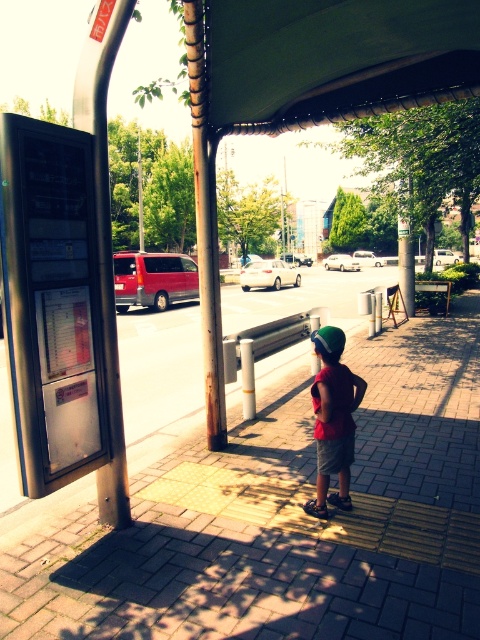
You are a parent trying to locate your child at a bus stop. You see a child wearing a matte red shirt at center and a green matte baseball hat at center. Which clothing item is higher on the child?

The matte red shirt at center is taller than the green matte baseball hat at center, so the matte red shirt at center is higher on the child.

You are a delivery person who needs to place a small package on the ground at the bus stop. The package is 1.2 meters wide. Can the brick pavement at center and the matte red shirt at center accommodate the package without overlapping?

The brick pavement at center has a lesser width compared to matte red shirt at center. Since the brick pavement is narrower than the matte red shirt, the package might not fit on the brick pavement. However, the matte red shirt at center is wider, so placing the package there could work if it aligns with its width. But since the shirt is worn by a person, it might not be appropriate to place the package there. Consider checking another location or asking the individual for permission.

You are a delivery person who needs to place a small box on the ground at the bus stop. The box must be placed on the brick pavement at center without covering the matte red shirt at center. Is this possible given their heights?

The brick pavement at center has a lesser height compared to matte red shirt at center, so placing the box on the brick pavement at center is possible as long as the shirt isn not on the pavement. However, since the shirt is at the same center position, they might be overlapping. The description only mentions height difference, not horizontal position, so it depends on their horizontal placement which isn unknown. The answer should focus on height. Since the pavement is lower, the shirt could be on top, but